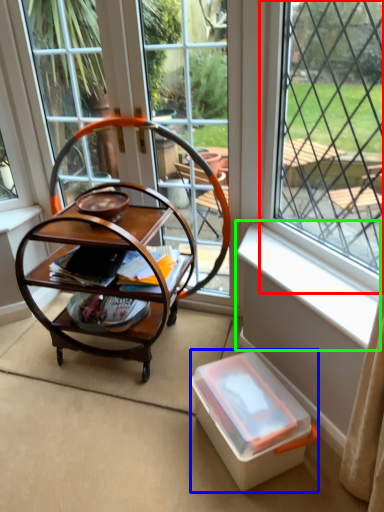
Question: Which object is the farthest from window (highlighted by a red box)? Choose among these: box (highlighted by a blue box) or window sill (highlighted by a green box).

Choices:
 (A) box
 (B) window sill

Answer: (A)